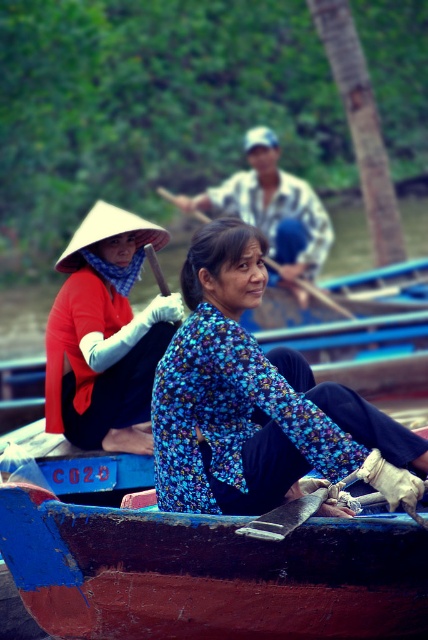
Does floral fabric woman at center appear on the right side of wooden smooth paddle at center?

Indeed, floral fabric woman at center is positioned on the right side of wooden smooth paddle at center.

Does floral fabric woman at center appear on the left side of wooden smooth paddle at center?

Incorrect, floral fabric woman at center is not on the left side of wooden smooth paddle at center.

Measure the distance between point (281, 186) and camera.

Point (281, 186) and camera are 80.74 feet apart from each other.

You are a GUI agent. You are given a task and a screenshot of the screen. Output one action in this format:
    pyautogui.click(x=<x>, y=<y>)
    Task: Click on the floral fabric woman at center
    The image size is (428, 640).
    Given the screenshot: What is the action you would take?
    pyautogui.click(x=273, y=211)

Does floral fabric shirt at center appear on the right side of wooden paddle at center?

No, floral fabric shirt at center is not to the right of wooden paddle at center.

Does floral fabric shirt at center have a greater height compared to wooden paddle at center?

In fact, floral fabric shirt at center may be shorter than wooden paddle at center.

Is point (300, 428) farther from viewer compared to point (323, 294)?

No.

Identify the location of floral fabric shirt at center. This screenshot has height=640, width=428. (249, 396).

Is matte red blouse at upper left taller than floral fabric woman at center?

No, matte red blouse at upper left is not taller than floral fabric woman at center.

I want to click on matte red blouse at upper left, so click(104, 333).

Find the location of a particular element. The image size is (428, 640). matte red blouse at upper left is located at coordinates (104, 333).